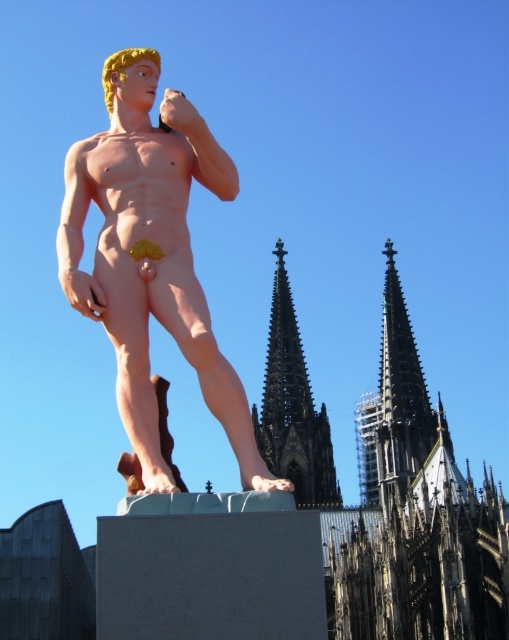
You are an art student analyzing the composition of this image. You notice the pink matte statue at center and the dark gray stone spire at upper right. Which object is located to the left of the other?

The pink matte statue at center is positioned on the left side of dark gray stone spire at upper right.

From the picture: You are an art student analyzing the image. You need to determine which object occupies more horizontal space in the composition. Based on the scene, which one is wider between the pink matte statue at center and the dark gray stone spire at upper right?

The pink matte statue at center is wider than the dark gray stone spire at upper right.

You are standing at the base of the Cologne Cathedral and want to take a photo of the modern statue. The statue is located at point [386,476]. If your camera has a maximum zoom range of 120 meters, will you be able to capture the statue clearly in your photo?

The point [386,476] is 143.00 meters away from the viewer. Since the camera can only zoom up to 120 meters, the statue will be out of the camera range and cannot be captured clearly.